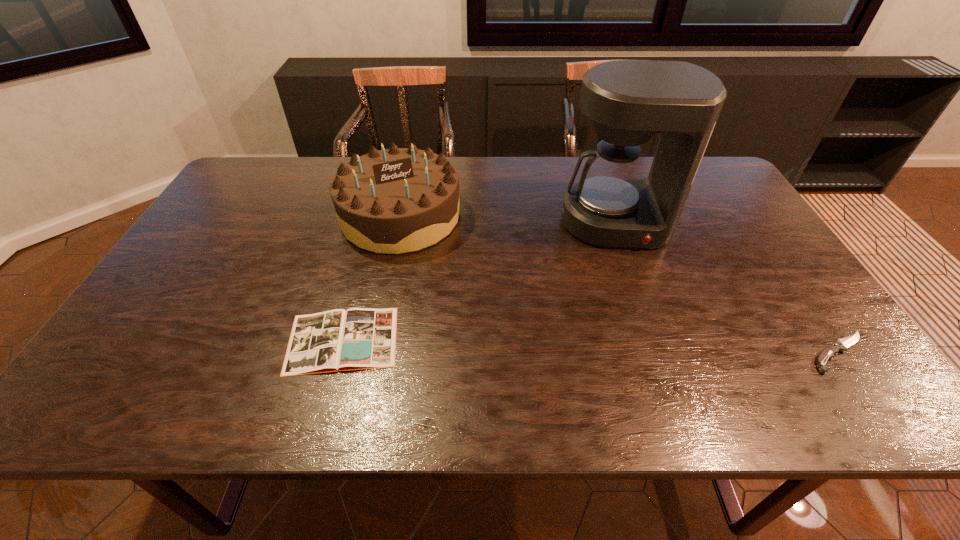
Locate an element on the screen. This screenshot has width=960, height=540. free space located 0.180m on the front-facing side of the coffee maker is located at coordinates (635, 301).

Where is `vacant area located 0.250m on the front-facing side of the coffee maker`? This screenshot has width=960, height=540. vacant area located 0.250m on the front-facing side of the coffee maker is located at coordinates (640, 323).

Locate an element on the screen. vacant space situated 0.150m on the front-facing side of the coffee maker is located at coordinates (632, 292).

Locate an element on the screen. object located at the far edge is located at coordinates (398, 200).

You are a GUI agent. You are given a task and a screenshot of the screen. Output one action in this format:
    pyautogui.click(x=<x>, y=<y>)
    Task: Click on the book at the near edge
    This screenshot has width=960, height=540.
    Given the screenshot: What is the action you would take?
    pyautogui.click(x=337, y=340)

At what (x,y) coordinates should I click in order to perform the action: click on pocketknife at the near edge. Please return your answer as a coordinate pair (x, y). Looking at the image, I should click on (827, 353).

You are a GUI agent. You are given a task and a screenshot of the screen. Output one action in this format:
    pyautogui.click(x=<x>, y=<y>)
    Task: Click on the object present at the right edge
    The height and width of the screenshot is (540, 960).
    Given the screenshot: What is the action you would take?
    point(827,353)

Locate an element on the screen. This screenshot has height=540, width=960. object that is at the near right corner is located at coordinates (827, 353).

The image size is (960, 540). In the image, there is a desktop. What are the coordinates of `free region at the far edge` in the screenshot? It's located at (640, 157).

At what (x,y) coordinates should I click in order to perform the action: click on vacant space at the near edge. Please return your answer as a coordinate pair (x, y). The width and height of the screenshot is (960, 540). Looking at the image, I should click on [746, 364].